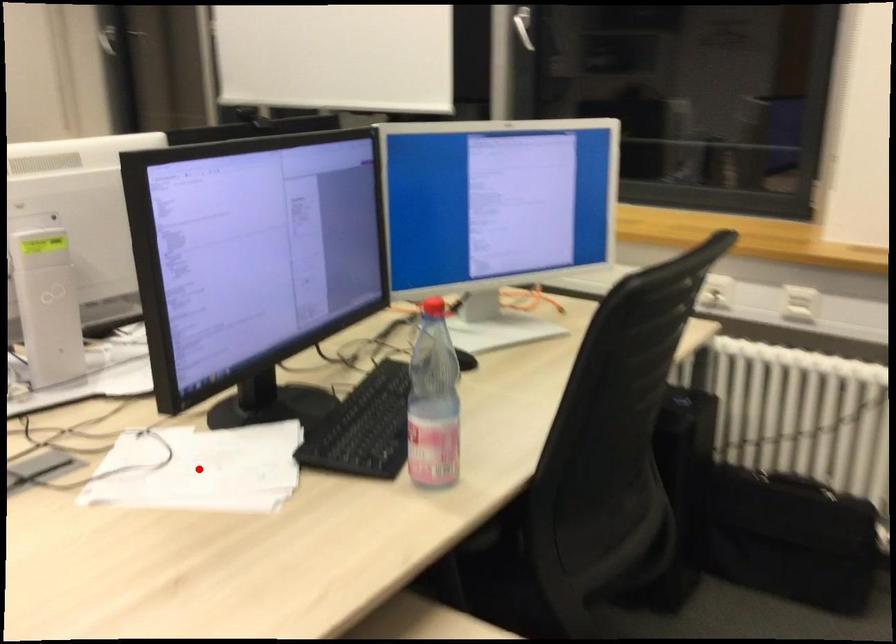
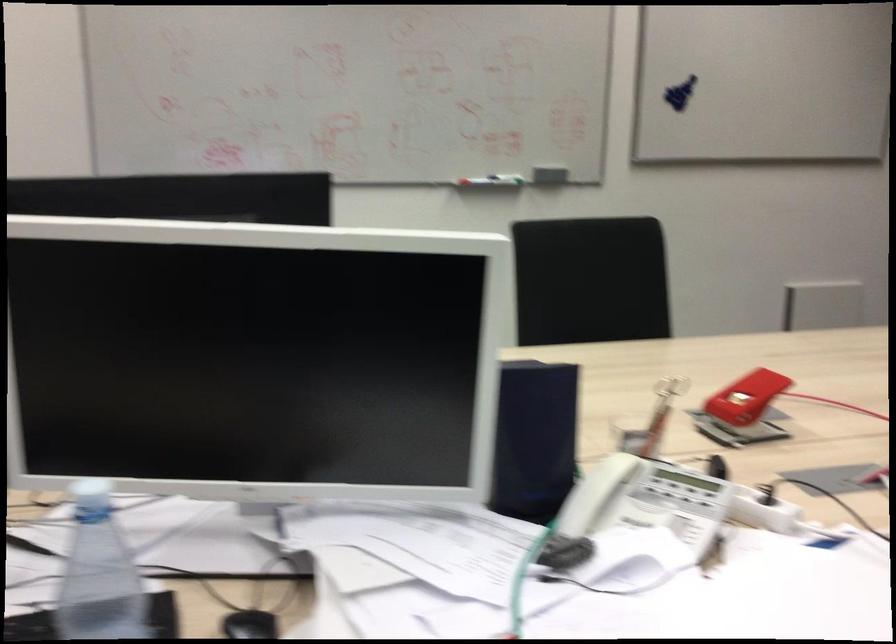
Question: I am providing you with two images of the same scene from different viewpoints. A red point is marked on the first image. At the location where the point appears in image 1, is it still visible in image 2?

Choices:
 (A) Yes
 (B) No

Answer: (B)